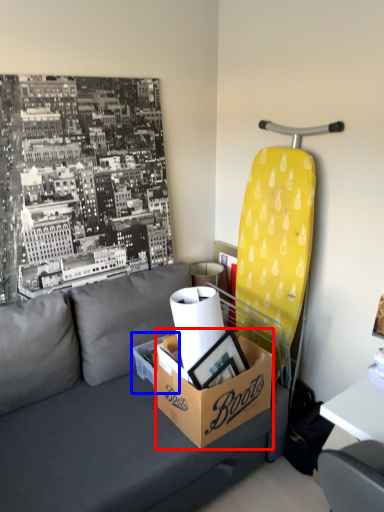
Question: Which of the following is the closest to the observer, box (highlighted by a red box) or cardboard box (highlighted by a blue box)?

Choices:
 (A) box
 (B) cardboard box

Answer: (A)